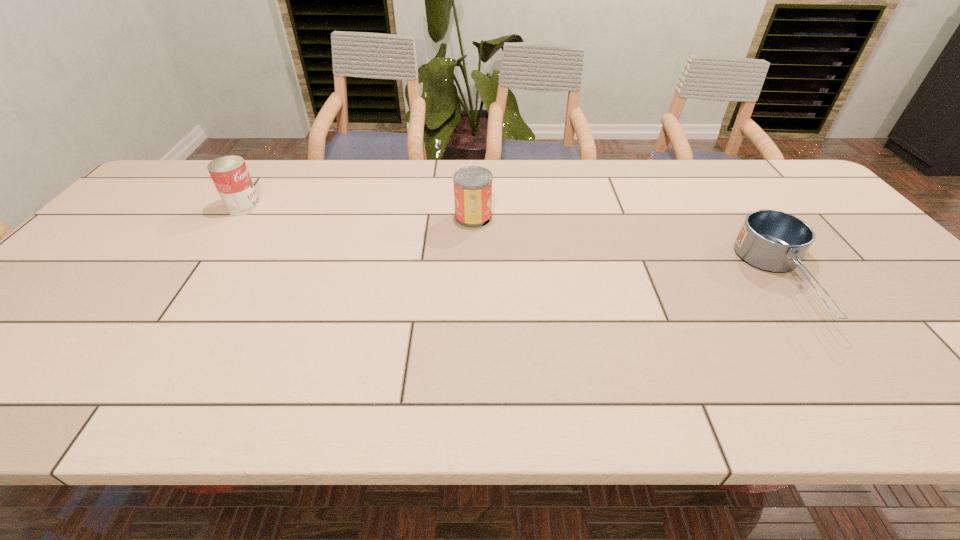
You are a GUI agent. You are given a task and a screenshot of the screen. Output one action in this format:
    pyautogui.click(x=<x>, y=<y>)
    Task: Click on the left can
    Image resolution: width=960 pixels, height=540 pixels.
    Given the screenshot: What is the action you would take?
    pyautogui.click(x=230, y=175)

The image size is (960, 540). I want to click on the right can, so click(472, 185).

This screenshot has height=540, width=960. Identify the location of the nearest object. (774, 241).

Find the location of a particular element. The height and width of the screenshot is (540, 960). saucepan is located at coordinates (774, 241).

Where is `vacant space situated on the front label of the leftmost object`? The image size is (960, 540). vacant space situated on the front label of the leftmost object is located at coordinates (347, 207).

Identify the location of blank space located on the left of the second object from left to right. pos(321,217).

At what (x,y) coordinates should I click in order to perform the action: click on free space located 0.090m with the handle extending from one side of the rightmost object. Please return your answer as a coordinate pair (x, y). Looking at the image, I should click on (852, 375).

Image resolution: width=960 pixels, height=540 pixels. Identify the location of object located at the far edge. (230, 175).

Identify the location of blank space at the far edge of the desktop. Image resolution: width=960 pixels, height=540 pixels. tap(586, 164).

Locate an element on the screen. The image size is (960, 540). vacant space at the near edge of the desktop is located at coordinates (460, 396).